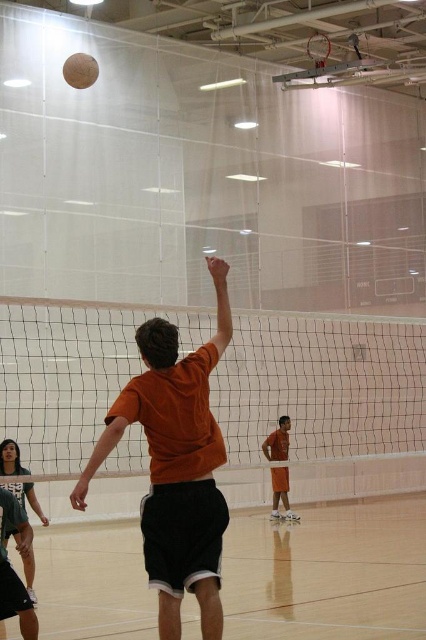
Does white mesh net at center appear under beige matte volleyball at upper center?

Yes, white mesh net at center is below beige matte volleyball at upper center.

Is the position of white mesh net at center less distant than that of beige matte volleyball at upper center?

Yes, white mesh net at center is closer to the viewer.

What do you see at coordinates (322, 385) in the screenshot? The image size is (426, 640). I see `white mesh net at center` at bounding box center [322, 385].

Identify the location of white mesh net at center. (322, 385).

Does wooden floor at center appear over beige matte volleyball at upper center?

No, wooden floor at center is not above beige matte volleyball at upper center.

Which is more to the right, wooden floor at center or beige matte volleyball at upper center?

Positioned to the right is wooden floor at center.

Image resolution: width=426 pixels, height=640 pixels. I want to click on wooden floor at center, so click(328, 572).

Does orange matte shirt at center have a larger size compared to beige matte volleyball at upper center?

Indeed, orange matte shirt at center has a larger size compared to beige matte volleyball at upper center.

Between orange matte shirt at center and beige matte volleyball at upper center, which one appears on the left side from the viewer's perspective?

beige matte volleyball at upper center

Which is in front, point (120, 428) or point (83, 76)?

Point (120, 428) is more forward.

Find the location of a particular element. This screenshot has height=640, width=426. orange matte shirt at center is located at coordinates (175, 465).